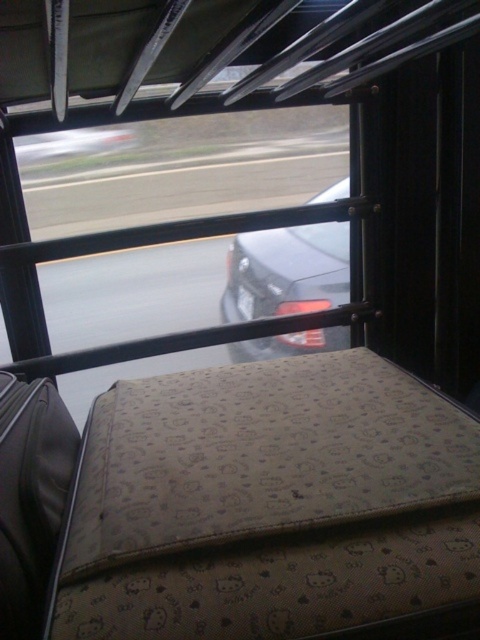
Question: Is shiny black car at center in front of metallic silver car at left?

Choices:
 (A) yes
 (B) no

Answer: (A)

Question: Estimate the real-world distances between objects in this image. Which object is farther from the metallic silver car at left?

Choices:
 (A) shiny black car at center
 (B) leather suitcase at lower left

Answer: (B)

Question: Does beige fabric suitcase at center appear on the left side of leather suitcase at lower left?

Choices:
 (A) yes
 (B) no

Answer: (B)

Question: Can you confirm if shiny black car at center is positioned above metallic silver car at left?

Choices:
 (A) yes
 (B) no

Answer: (B)

Question: Which is nearer to the shiny black car at center?

Choices:
 (A) leather suitcase at lower left
 (B) metallic silver car at left
 (C) beige fabric suitcase at center

Answer: (B)

Question: Which object is farther from the camera taking this photo?

Choices:
 (A) leather suitcase at lower left
 (B) beige fabric suitcase at center
 (C) metallic silver car at left

Answer: (C)